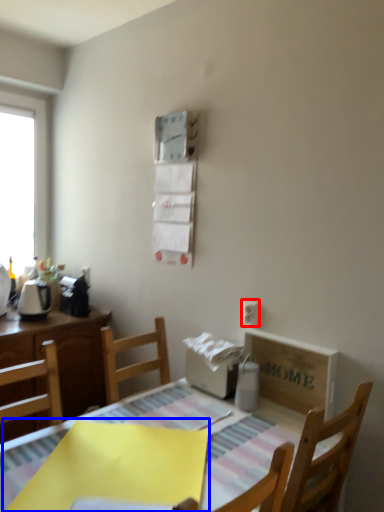
Question: Which object appears farthest to the camera in this image, electric outlet (highlighted by a red box) or cloth (highlighted by a blue box)?

Choices:
 (A) electric outlet
 (B) cloth

Answer: (A)